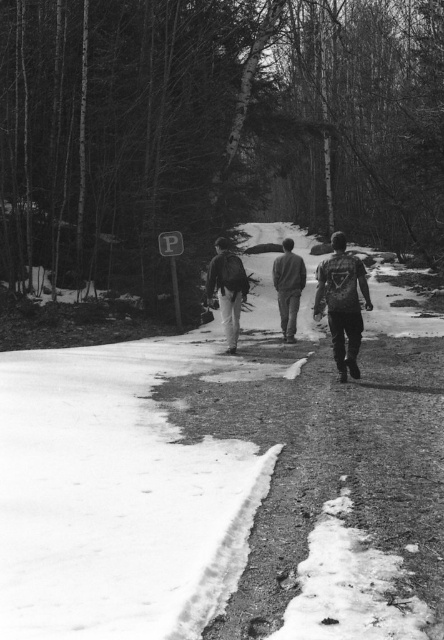
You are a hiker who just arrived at the trailhead and see the dark gray fabric backpack at center and the matte black jacket at center in the distance. Which item is closer to you?

The dark gray fabric backpack at center is closer to you since it is in front of the matte black jacket at center.

You are standing at the camera position looking at the three individuals walking away on the snow path. Where is the dark gray fabric backpack at center in relation to the path?

The dark gray fabric backpack at center is located at point [343,304], which is on the path where the individuals are walking.